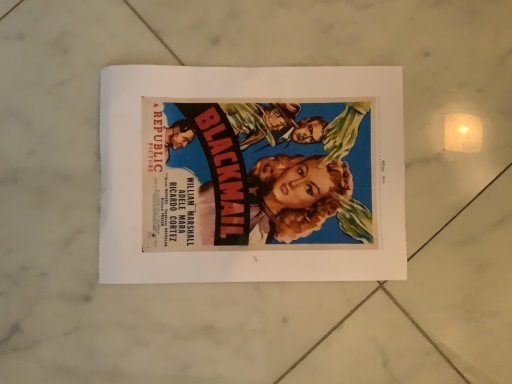
The width and height of the screenshot is (512, 384). What are the coordinates of `vacant space situated above matte paper poster at center (from a real-world perspective)` in the screenshot? It's located at (247, 172).